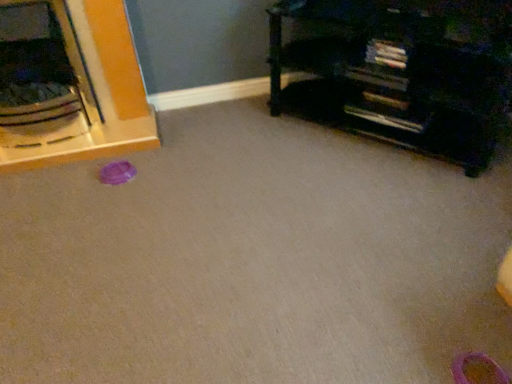
Identify the location of vacant region to the right of brushed metal bowl at left, which appears as the first furniture when viewed from the left. This screenshot has width=512, height=384. (184, 147).